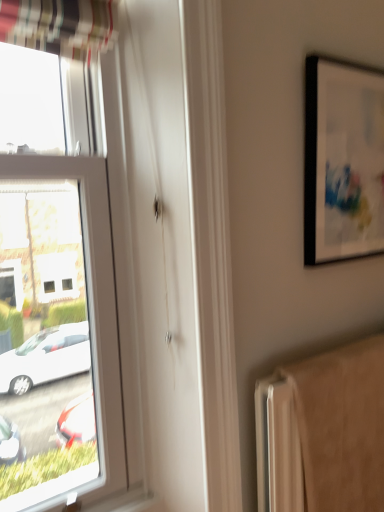
Question: Visually, is beige fabric radiator at lower right positioned to the left or to the right of black matte picture frame at upper right?

Choices:
 (A) right
 (B) left

Answer: (B)

Question: From the image's perspective, is beige fabric radiator at lower right located above or below black matte picture frame at upper right?

Choices:
 (A) below
 (B) above

Answer: (A)

Question: Choose the correct answer: Is beige fabric radiator at lower right inside black matte picture frame at upper right or outside it?

Choices:
 (A) inside
 (B) outside

Answer: (B)

Question: From a real-world perspective, relative to beige fabric radiator at lower right, is black matte picture frame at upper right vertically above or below?

Choices:
 (A) below
 (B) above

Answer: (B)

Question: In the image, is black matte picture frame at upper right positioned in front of or behind beige fabric radiator at lower right?

Choices:
 (A) front
 (B) behind

Answer: (B)

Question: From the image's perspective, is black matte picture frame at upper right located above or below beige fabric radiator at lower right?

Choices:
 (A) above
 (B) below

Answer: (A)

Question: Is point (349, 130) positioned closer to the camera than point (261, 384)?

Choices:
 (A) farther
 (B) closer

Answer: (A)